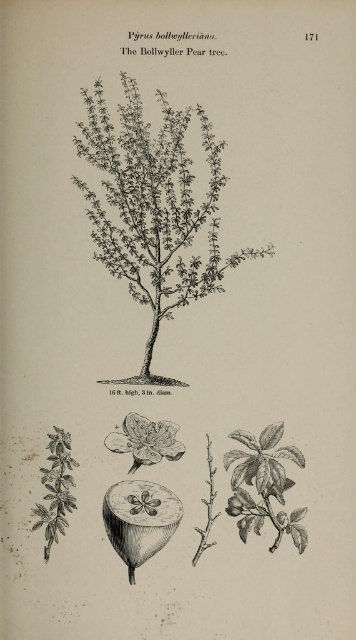
You are holding a vintage botanical book open to page 171, which contains an illustration of the Bollwyller Pear tree. The book is placed on a table in front of you. If your eyes are at a height of 1.6 meters above the table, can you see the entire black line drawing tree at center without tilting your head?

The black line drawing tree at center and viewer are 1.54 meters apart from each other. Since your eyes are 1.6 meters above the table, you can see the entire black line drawing tree at center without tilting your head because the distance between you and the tree is slightly less than your eye height, allowing for a clear, upright view.